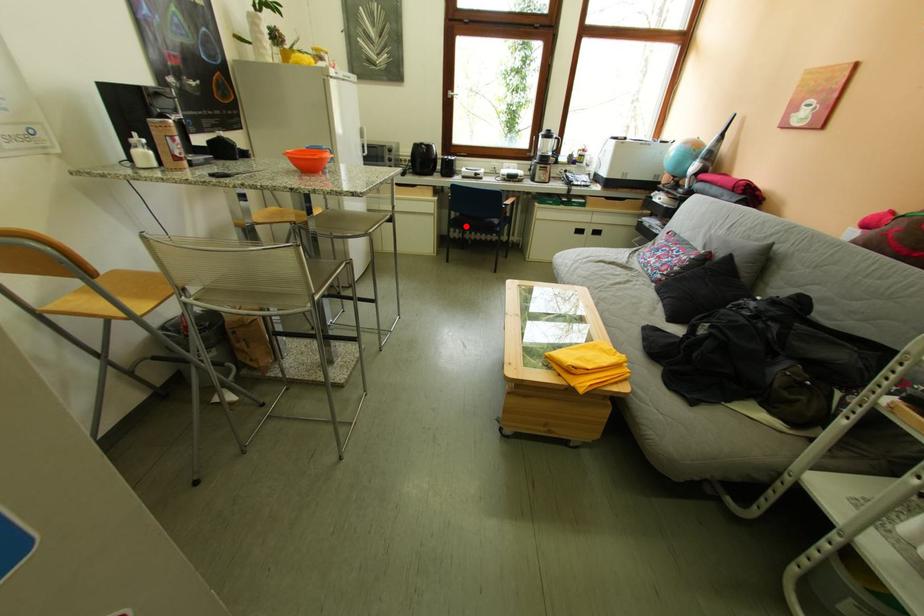
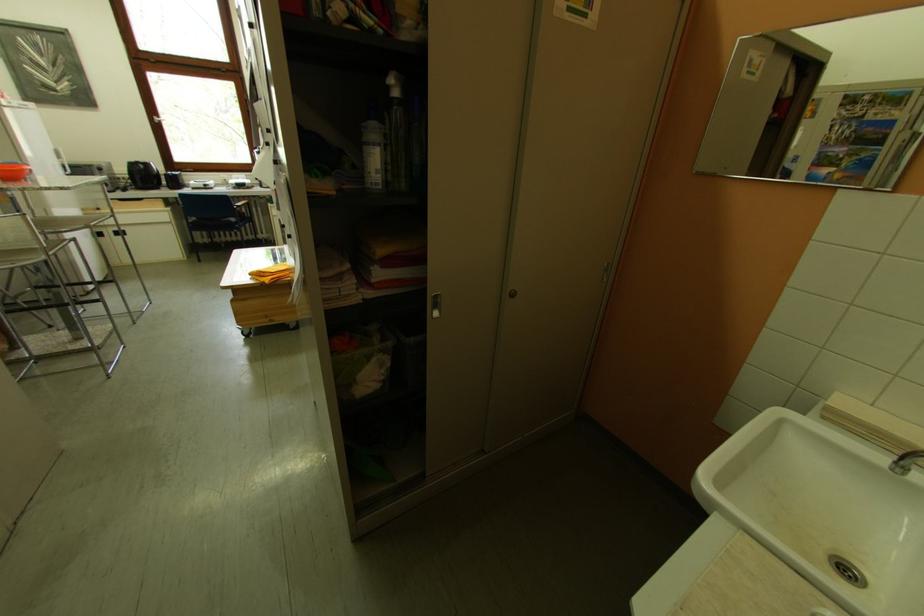
Locate, in the second image, the point that corresponds to the highlighted location in the first image.

(207, 230)